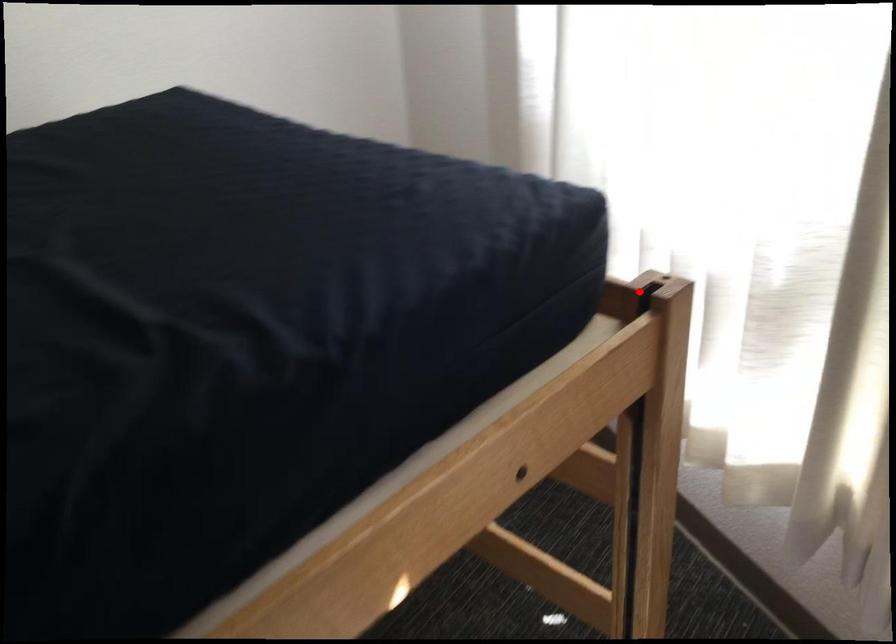
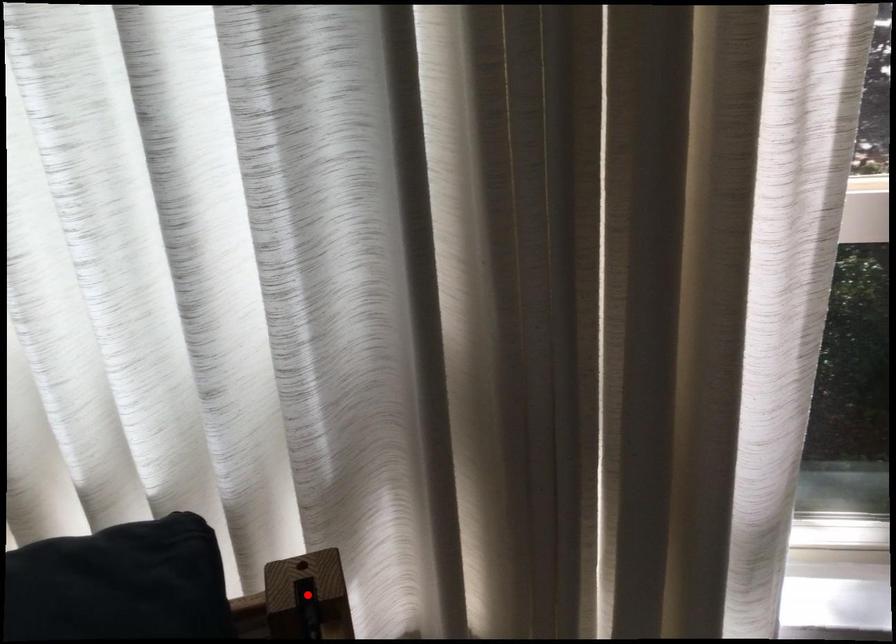
I am providing you with two images of the same scene from different viewpoints. A red point is marked on the first image and another point is marked on the second image. Do the highlighted points in image1 and image2 indicate the same real-world spot?

Yes